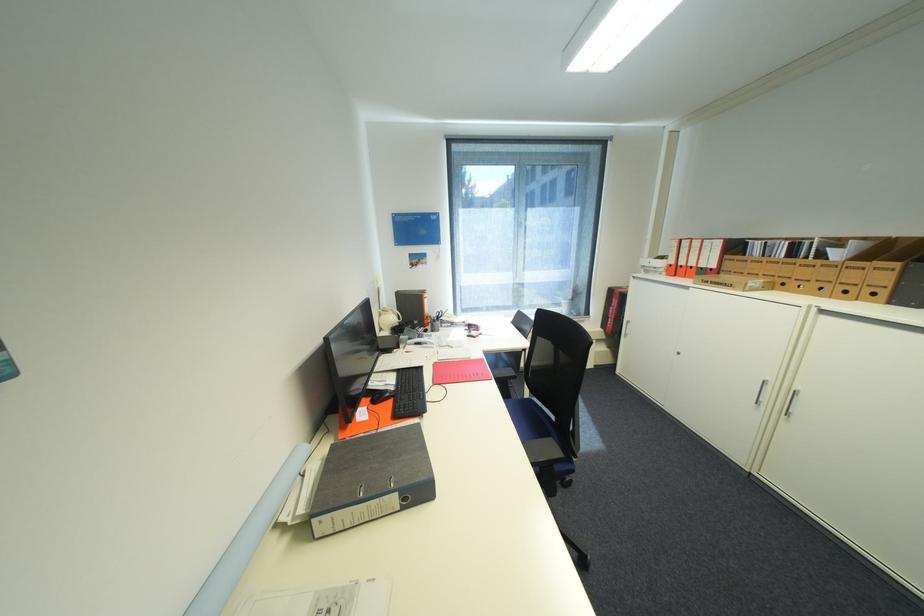
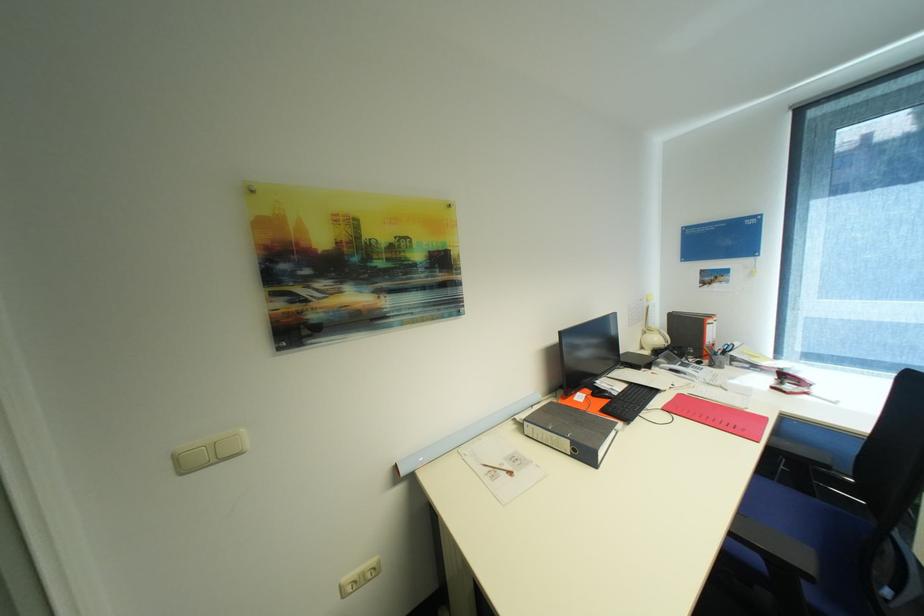
The point at (x=489, y=334) is marked in the first image. Where is the corresponding point in the second image?

(813, 394)